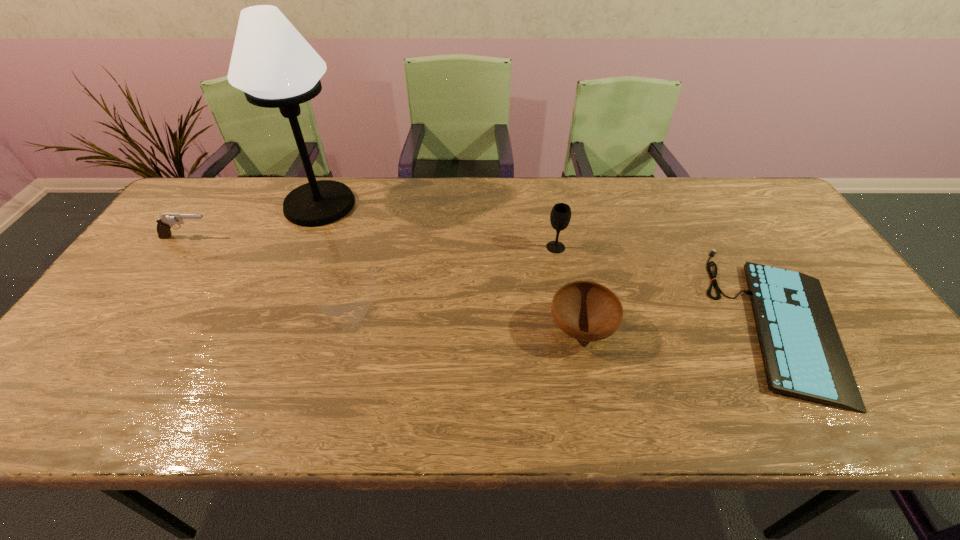
Identify the location of free point located at the muzzle of the second farthest object. (241, 238).

Find the location of a particular element. This screenshot has width=960, height=540. vacant space situated on the right of the bowl is located at coordinates (763, 329).

The image size is (960, 540). Find the location of `vacant area situated on the back of the shortest object`. vacant area situated on the back of the shortest object is located at coordinates (726, 226).

At what (x,y) coordinates should I click in order to perform the action: click on object positioned at the far edge. Please return your answer as a coordinate pair (x, y). Looking at the image, I should click on (275, 67).

Locate an element on the screen. This screenshot has width=960, height=540. object that is at the near edge is located at coordinates (803, 356).

Where is `object that is at the left edge`? The width and height of the screenshot is (960, 540). object that is at the left edge is located at coordinates (166, 221).

The image size is (960, 540). Identify the location of object present at the right edge. (803, 356).

The width and height of the screenshot is (960, 540). Find the location of `object that is at the near right corner`. object that is at the near right corner is located at coordinates (803, 356).

In the image, there is a desktop. Identify the location of blank space at the far edge. Image resolution: width=960 pixels, height=540 pixels. (631, 202).

This screenshot has width=960, height=540. In the image, there is a desktop. In order to click on vacant space at the left edge in this screenshot , I will do `click(150, 320)`.